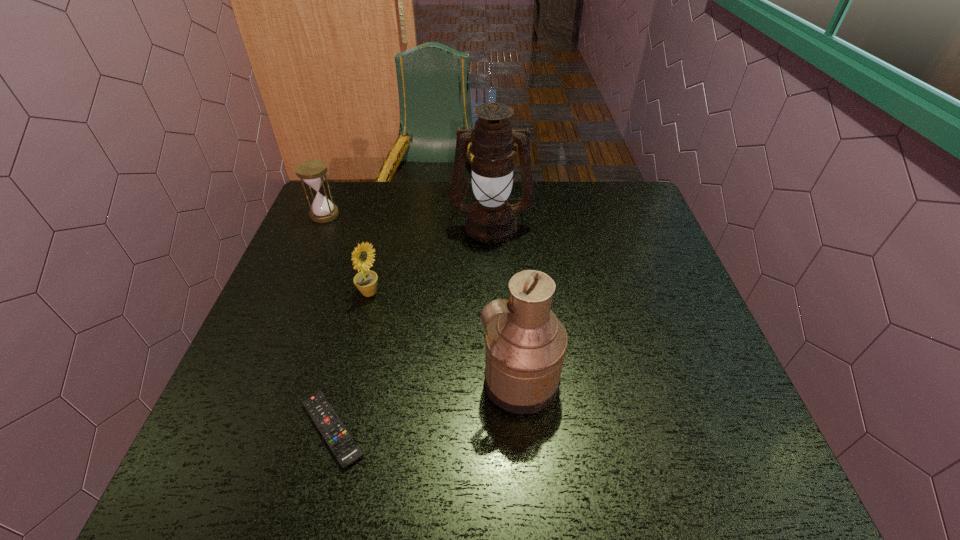
Find the location of a particular element. vacant region between the second tallest object and the shortest object is located at coordinates click(426, 405).

I want to click on the second closest object to the third farthest object, so pyautogui.click(x=345, y=449).

Select which object appears as the fourth closest to the hourglass. Please provide its 2D coordinates. Your answer should be formatted as a tuple, i.e. [(x, y)], where the tuple contains the x and y coordinates of a point satisfying the conditions above.

[(526, 343)]

I want to click on blank space that satisfies the following two spatial constraints: 1. on the face of the fourth shortest object; 2. on the left side of the sunflower, so click(x=348, y=381).

Where is `vacant area in the image that satisfies the following two spatial constraints: 1. on the face of the fourth shortest object; 2. on the right side of the sunflower`? The width and height of the screenshot is (960, 540). vacant area in the image that satisfies the following two spatial constraints: 1. on the face of the fourth shortest object; 2. on the right side of the sunflower is located at coordinates (348, 381).

Locate an element on the screen. free location that satisfies the following two spatial constraints: 1. on the face of the third nearest object; 2. on the back side of the pitcher is located at coordinates (348, 381).

The width and height of the screenshot is (960, 540). I want to click on vacant region that satisfies the following two spatial constraints: 1. on the front side of the tallest object; 2. on the right side of the second tallest object, so click(495, 381).

The width and height of the screenshot is (960, 540). In order to click on vacant region that satisfies the following two spatial constraints: 1. on the front side of the tallest object; 2. on the face of the third farthest object in this screenshot , I will do `click(493, 293)`.

The image size is (960, 540). What are the coordinates of `free space that satisfies the following two spatial constraints: 1. on the front side of the pitcher; 2. on the left side of the tallest object` in the screenshot? It's located at (495, 381).